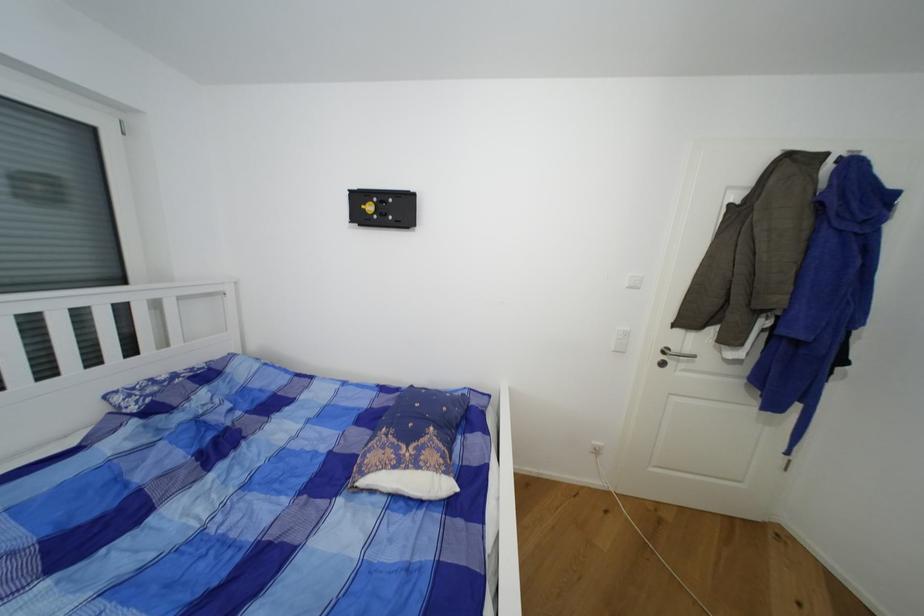
Where is `white light switch`? white light switch is located at coordinates click(621, 339).